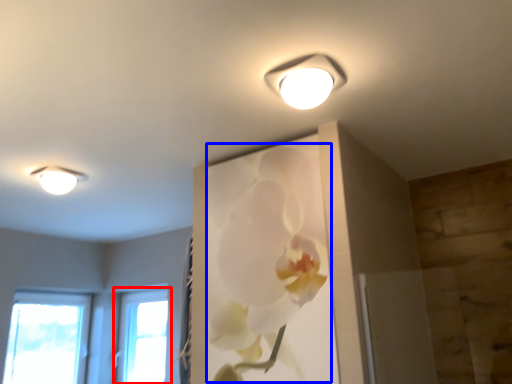
Question: Which object appears farthest to the camera in this image, window (highlighted by a red box) or floral arrangement (highlighted by a blue box)?

Choices:
 (A) window
 (B) floral arrangement

Answer: (A)